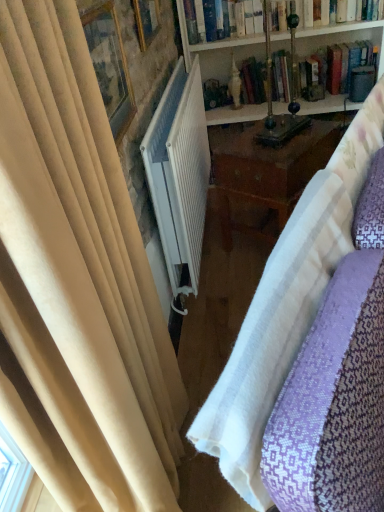
Question: Are brass table lamp at center and white ribbed radiator at center making contact?

Choices:
 (A) yes
 (B) no

Answer: (B)

Question: Is brass table lamp at center looking in the opposite direction of white ribbed radiator at center?

Choices:
 (A) yes
 (B) no

Answer: (A)

Question: Can you confirm if brass table lamp at center is taller than white ribbed radiator at center?

Choices:
 (A) no
 (B) yes

Answer: (B)

Question: Is brass table lamp at center at the right side of white ribbed radiator at center?

Choices:
 (A) yes
 (B) no

Answer: (A)

Question: From the image's perspective, is brass table lamp at center beneath white ribbed radiator at center?

Choices:
 (A) yes
 (B) no

Answer: (B)

Question: From the image's perspective, is brass table lamp at center over white ribbed radiator at center?

Choices:
 (A) yes
 (B) no

Answer: (A)

Question: Is brass table lamp at center positioned behind wooden picture frame at upper center, the 1th picture frame from the top?

Choices:
 (A) no
 (B) yes

Answer: (B)

Question: Is brass table lamp at center to the left of wooden picture frame at upper center, the 1th picture frame from the top, from the viewer's perspective?

Choices:
 (A) yes
 (B) no

Answer: (B)

Question: Is brass table lamp at center oriented towards wooden picture frame at upper center, the 1th picture frame from the top?

Choices:
 (A) no
 (B) yes

Answer: (A)

Question: Is brass table lamp at center wider than wooden picture frame at upper center, the second picture frame from the bottom?

Choices:
 (A) no
 (B) yes

Answer: (B)

Question: From a real-world perspective, is brass table lamp at center physically below wooden picture frame at upper center, the second picture frame from the bottom?

Choices:
 (A) yes
 (B) no

Answer: (A)

Question: Is brass table lamp at center beside wooden picture frame at upper center, the second picture frame from the bottom?

Choices:
 (A) no
 (B) yes

Answer: (A)

Question: Is white textured fabric at center positioned behind wooden picture frame at upper center, the 1th picture frame from the top?

Choices:
 (A) no
 (B) yes

Answer: (A)